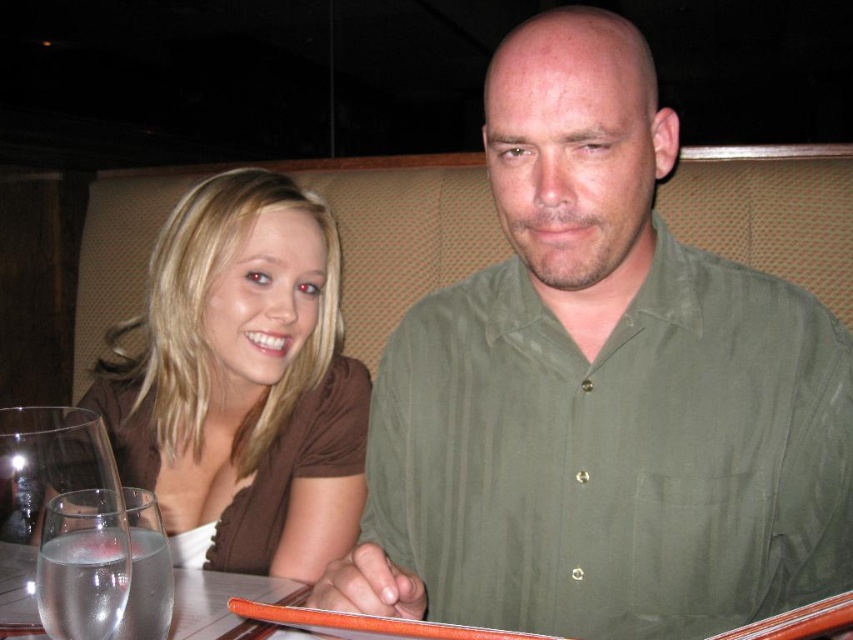
Who is positioned more to the left, clear glass wine glass at lower left or clear glass at lower left?

From the viewer's perspective, clear glass wine glass at lower left appears more on the left side.

Is point (7, 420) more distant than point (131, 552)?

Yes, it is behind point (131, 552).

Is point (80, 428) positioned in front of point (103, 593)?

No.

Find the location of a particular element. clear glass wine glass at lower left is located at coordinates (56, 496).

Consider the image. Is clear glass at lower left closer to the viewer compared to clear glass water at lower left?

Yes, clear glass at lower left is closer to the viewer.

Is clear glass at lower left taller than clear glass water at lower left?

No, clear glass at lower left is not taller than clear glass water at lower left.

Which is behind, point (90, 545) or point (231, 630)?

Positioned behind is point (231, 630).

I want to click on clear glass at lower left, so click(x=103, y=566).

Which is behind, point (22, 438) or point (213, 576)?

Positioned behind is point (213, 576).

Which is above, clear glass wine glass at lower left or clear glass water at lower left?

clear glass wine glass at lower left

You are a GUI agent. You are given a task and a screenshot of the screen. Output one action in this format:
    pyautogui.click(x=<x>, y=<y>)
    Task: Click on the clear glass wine glass at lower left
    
    Given the screenshot: What is the action you would take?
    pyautogui.click(x=56, y=496)